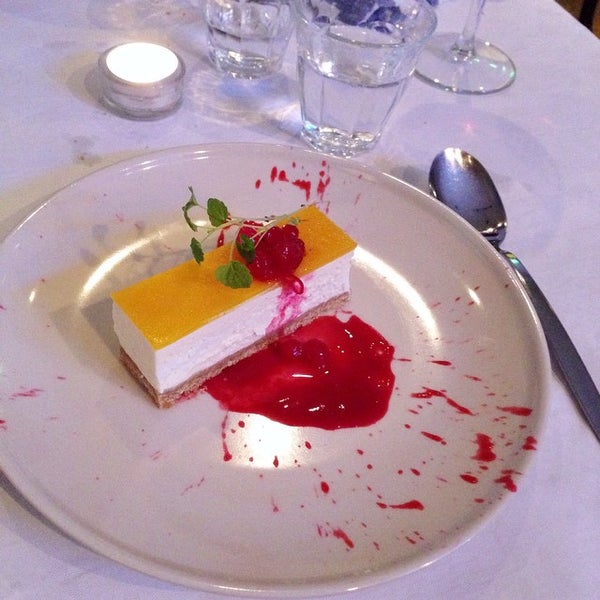
Find the location of a particular element. wine glass stem is located at coordinates (470, 20).